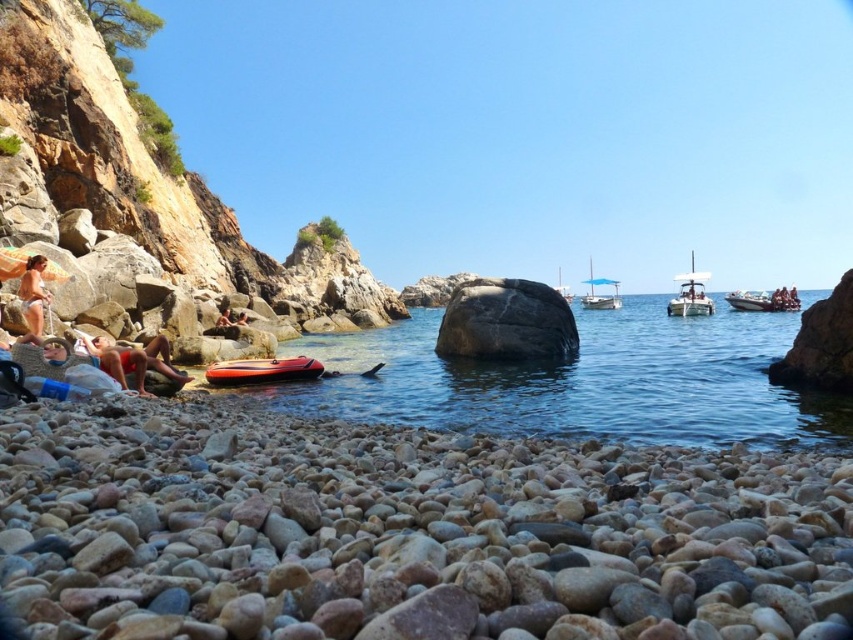
Question: Which point is farther from the camera taking this photo?

Choices:
 (A) (39, 296)
 (B) (306, 364)
 (C) (669, 307)

Answer: (C)

Question: Does smooth pebbles at lower center lie in front of white plastic boat at center?

Choices:
 (A) yes
 (B) no

Answer: (A)

Question: Can you confirm if white glossy motorboat at right is positioned to the left of white plastic boat at center?

Choices:
 (A) yes
 (B) no

Answer: (B)

Question: Can you confirm if white glossy motorboat at right is positioned above blue fabric sailboat at center?

Choices:
 (A) no
 (B) yes

Answer: (A)

Question: Based on their relative distances, which object is nearer to the white glossy motorboat at right?

Choices:
 (A) white plastic boat at center
 (B) white glossy boat at right
 (C) blue fabric sailboat at center
 (D) smooth pebbles at lower center

Answer: (B)

Question: Which of the following is the closest to the observer?

Choices:
 (A) (671, 365)
 (B) (183, 579)

Answer: (B)